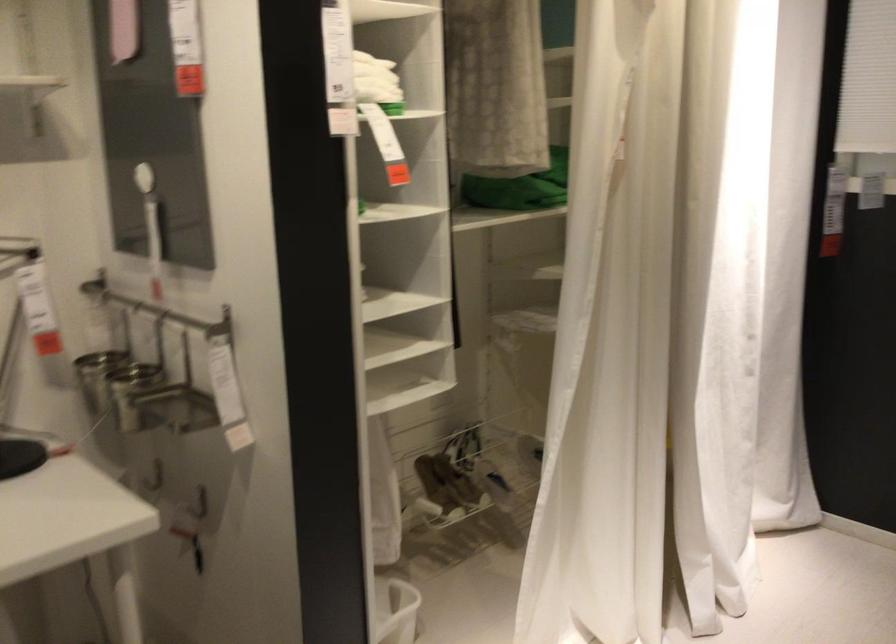
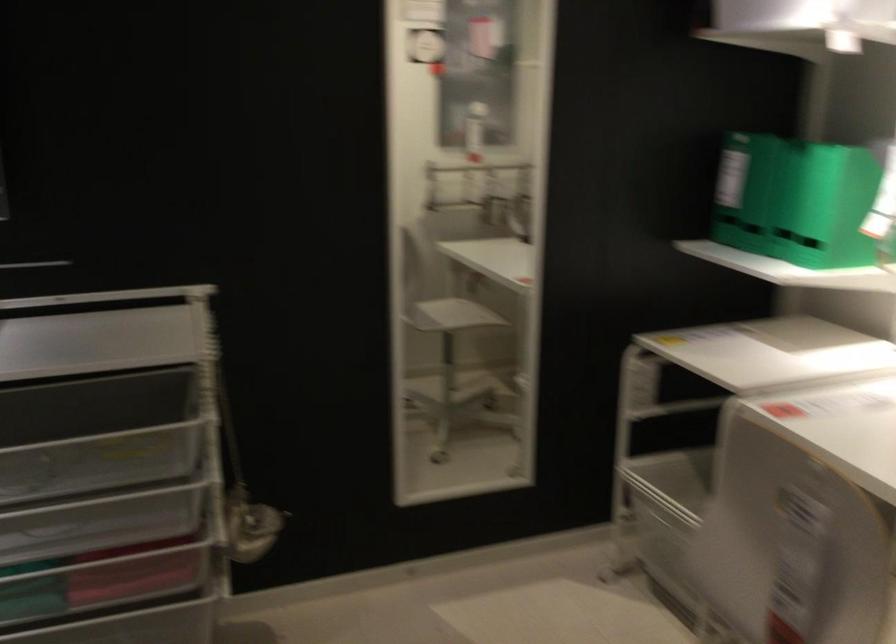
How did the camera likely rotate?

The rotation direction of the camera is left-down.